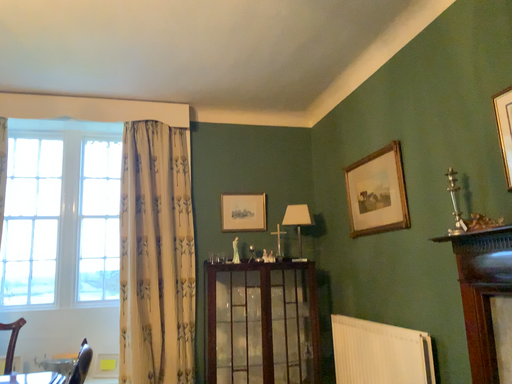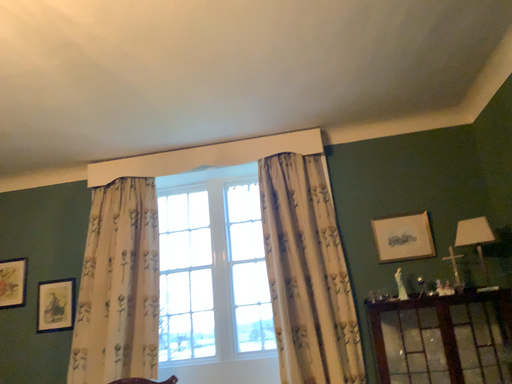
Question: Which way did the camera rotate in the video?

Choices:
 (A) rotated left
 (B) rotated right

Answer: (A)